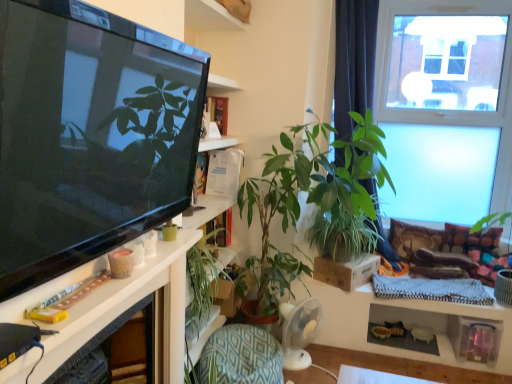
The image size is (512, 384). I want to click on transparent glass window at upper right, so click(x=445, y=109).

The width and height of the screenshot is (512, 384). Identify the location of green textured cushion at lower center. (241, 356).

What do you see at coordinates (128, 308) in the screenshot?
I see `white glossy shelf at left` at bounding box center [128, 308].

This screenshot has height=384, width=512. What are the coordinates of `transparent glass window at upper right` in the screenshot? It's located at (445, 109).

Which houseplant is the 2nd one when counting from the front of the transparent glass window at upper right? Please provide its 2D coordinates.

[(310, 193)]

Looking at this image, would you say transparent glass window at upper right is a long distance from green leafy plant at center, placed as the second houseplant when sorted from left to right?

Indeed, transparent glass window at upper right is not near green leafy plant at center, placed as the second houseplant when sorted from left to right.

Which object is positioned more to the right, transparent glass window at upper right or green leafy plant at center, which is the first houseplant in right-to-left order?

From the viewer's perspective, transparent glass window at upper right appears more on the right side.

Is transparent glass window at upper right located outside green leafy plant at center, placed as the second houseplant when sorted from left to right?

Yes, transparent glass window at upper right is located beyond the bounds of green leafy plant at center, placed as the second houseplant when sorted from left to right.

Is white glossy shelf at left outside of green leafy plant at center, the 2th houseplant positioned from the right?

Absolutely, white glossy shelf at left is external to green leafy plant at center, the 2th houseplant positioned from the right.

Which object is positioned more to the left, white glossy shelf at left or green leafy plant at center, the 2th houseplant positioned from the right?

Positioned to the left is white glossy shelf at left.

Can you tell me how much white glossy shelf at left and green leafy plant at center, acting as the first houseplant starting from the left, differ in facing direction?

There is a 8.81-degree angle between the facing directions of white glossy shelf at left and green leafy plant at center, acting as the first houseplant starting from the left.

Considering the points (12, 376) and (232, 288), which point is in front, point (12, 376) or point (232, 288)?

The point (12, 376) is more forward.

Considering the sizes of objects green leafy plant at center, acting as the first houseplant starting from the left, and white glossy shelf at left in the image provided, who is bigger, green leafy plant at center, acting as the first houseplant starting from the left, or white glossy shelf at left?

With larger size is green leafy plant at center, acting as the first houseplant starting from the left.

Is point (205, 328) farther from camera compared to point (200, 232)?

Yes.

From a real-world perspective, which object rests below the other?

green leafy plant at center, acting as the first houseplant starting from the left, is physically lower.

Which is more to the right, green leafy plant at center, acting as the first houseplant starting from the left, or white glossy shelf at left?

green leafy plant at center, acting as the first houseplant starting from the left.

From a real-world perspective, is green textured cushion at lower center above or below green leafy plant at center, the 2th houseplant positioned from the right?

green textured cushion at lower center is below green leafy plant at center, the 2th houseplant positioned from the right.

Is green textured cushion at lower center spatially inside green leafy plant at center, acting as the first houseplant starting from the left, or outside of it?

The correct answer is: outside.

Is green textured cushion at lower center smaller than green leafy plant at center, acting as the first houseplant starting from the left?

No.

Is green textured cushion at lower center positioned in front of green leafy plant at center, the 2th houseplant positioned from the right?

Yes, green textured cushion at lower center is closer to the viewer.

Which is in front, green leafy plant at center, the 2th houseplant positioned from the right, or green leafy plant at center, placed as the second houseplant when sorted from left to right?

green leafy plant at center, placed as the second houseplant when sorted from left to right.

Between point (197, 283) and point (364, 211), which one is positioned behind?

The point (364, 211) is more distant.

Could green leafy plant at center, placed as the second houseplant when sorted from left to right, be considered to be inside green leafy plant at center, the 2th houseplant positioned from the right?

Actually, green leafy plant at center, placed as the second houseplant when sorted from left to right, is outside green leafy plant at center, the 2th houseplant positioned from the right.

From the image's perspective, would you say green leafy plant at center, the 2th houseplant positioned from the right, is shown under green leafy plant at center, which is the first houseplant in right-to-left order?

Yes.

Is green leafy plant at center, acting as the first houseplant starting from the left, to the left or to the right of green textured cushion at lower center in the image?

From the image, it's evident that green leafy plant at center, acting as the first houseplant starting from the left, is to the left of green textured cushion at lower center.

From a real-world perspective, which houseplant is the 1st one above the green textured cushion at lower center? Please provide its 2D coordinates.

[(203, 288)]

Based on the photo, from a real-world perspective, is green leafy plant at center, the 2th houseplant positioned from the right, physically located above or below green textured cushion at lower center?

Clearly, from a real-world perspective, green leafy plant at center, the 2th houseplant positioned from the right, is above green textured cushion at lower center.

From the image's perspective, is green leafy plant at center, the 2th houseplant positioned from the right, positioned above or below green textured cushion at lower center?

From the image's perspective, green leafy plant at center, the 2th houseplant positioned from the right, appears above green textured cushion at lower center.

Is green textured cushion at lower center next to transparent glass window at upper right?

There is a gap between green textured cushion at lower center and transparent glass window at upper right.

Can you confirm if green textured cushion at lower center is taller than transparent glass window at upper right?

No, green textured cushion at lower center is not taller than transparent glass window at upper right.

Which is less distant, (224,377) or (441,200)?

The point (224,377) is closer.

Find the location of a particular element. This screenshot has width=512, height=384. the 1st houseplant to the left of the transparent glass window at upper right, counting from the anchor's position is located at coordinates (310, 193).

At what (x,y) coordinates should I click in order to perform the action: click on shelf located above the green leafy plant at center, acting as the first houseplant starting from the left (from the image's perspective). Please return your answer as a coordinate pair (x, y). Looking at the image, I should click on (128, 308).

Estimate the real-world distances between objects in this image. Which object is closer to green leafy plant at center, placed as the second houseplant when sorted from left to right, green leafy plant at center, the 2th houseplant positioned from the right, or green textured cushion at lower center?

The object closer to green leafy plant at center, placed as the second houseplant when sorted from left to right, is green leafy plant at center, the 2th houseplant positioned from the right.

Considering their positions, is green leafy plant at center, which is the first houseplant in right-to-left order, positioned closer to green leafy plant at center, the 2th houseplant positioned from the right, than white glossy shelf at left?

white glossy shelf at left lies closer to green leafy plant at center, the 2th houseplant positioned from the right, than the other object.

When comparing their distances from green textured cushion at lower center, does white glossy shelf at left or green leafy plant at center, the 2th houseplant positioned from the right, seem closer?

green leafy plant at center, the 2th houseplant positioned from the right, lies closer to green textured cushion at lower center than the other object.

Based on their spatial positions, is transparent glass window at upper right or green textured cushion at lower center closer to green leafy plant at center, acting as the first houseplant starting from the left?

The object closer to green leafy plant at center, acting as the first houseplant starting from the left, is green textured cushion at lower center.

Looking at the image, which one is located further to green leafy plant at center, placed as the second houseplant when sorted from left to right, white glossy shelf at left or green leafy plant at center, the 2th houseplant positioned from the right?

white glossy shelf at left.

Estimate the real-world distances between objects in this image. Which object is closer to green leafy plant at center, which is the first houseplant in right-to-left order, transparent glass window at upper right or green textured cushion at lower center?

The object closer to green leafy plant at center, which is the first houseplant in right-to-left order, is green textured cushion at lower center.

Based on their spatial positions, is green leafy plant at center, the 2th houseplant positioned from the right, or white glossy shelf at left further from green textured cushion at lower center?

Based on the image, white glossy shelf at left appears to be further to green textured cushion at lower center.

Based on the photo, looking at the image, which one is located closer to green leafy plant at center, the 2th houseplant positioned from the right, white glossy shelf at left or green textured cushion at lower center?

Among the two, green textured cushion at lower center is located nearer to green leafy plant at center, the 2th houseplant positioned from the right.

This screenshot has height=384, width=512. Find the location of `armchair positioned between white glossy shelf at left and green leafy plant at center, the 2th houseplant positioned from the right, from near to far`. armchair positioned between white glossy shelf at left and green leafy plant at center, the 2th houseplant positioned from the right, from near to far is located at coordinates (241, 356).

At what (x,y) coordinates should I click in order to perform the action: click on houseplant positioned between white glossy shelf at left and green leafy plant at center, the 2th houseplant positioned from the right, from near to far. Please return your answer as a coordinate pair (x, y). Looking at the image, I should click on (310, 193).

Locate an element on the screen. armchair positioned between white glossy shelf at left and transparent glass window at upper right from near to far is located at coordinates (241, 356).

At what (x,y) coordinates should I click in order to perform the action: click on houseplant situated between green leafy plant at center, acting as the first houseplant starting from the left, and transparent glass window at upper right from left to right. Please return your answer as a coordinate pair (x, y). Looking at the image, I should click on (310, 193).